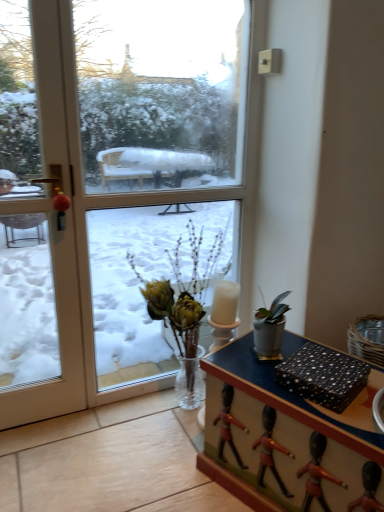
Find the location of a particular element. The width and height of the screenshot is (384, 512). black dotted paper at lower right is located at coordinates (323, 376).

Considering the relative sizes of translucent glass vase at center and wooden desk at center in the image provided, is translucent glass vase at center smaller than wooden desk at center?

Incorrect, translucent glass vase at center is not smaller in size than wooden desk at center.

How many degrees apart are the facing directions of translucent glass vase at center and wooden desk at center?

The facing directions of translucent glass vase at center and wooden desk at center are 65.6 degrees apart.

This screenshot has height=512, width=384. In order to click on desk below the translucent glass vase at center (from a real-world perspective) in this screenshot , I will do `click(283, 441)`.

Can we say translucent glass vase at center lies outside white glossy door at left?

translucent glass vase at center lies outside white glossy door at left's area.

Based on the photo, which object is closer to the camera, translucent glass vase at center or white glossy door at left?

white glossy door at left is closer to the camera.

Which object is positioned more to the right, translucent glass vase at center or white glossy door at left?

translucent glass vase at center.

From a real-world perspective, is translucent glass vase at center physically below white glossy door at left?

Yes.

Considering the positions of point (224, 377) and point (275, 374), is point (224, 377) closer or farther from the camera than point (275, 374)?

Point (224, 377) is farther from the camera than point (275, 374).

Can you confirm if wooden desk at center is positioned to the right of black dotted paper at lower right?

In fact, wooden desk at center is to the left of black dotted paper at lower right.

Is wooden desk at center aimed at white glossy door at left?

No, wooden desk at center is not oriented towards white glossy door at left.

Can you see wooden desk at center touching white glossy door at left?

They are not placed beside each other.

Is white glossy door at left a part of wooden desk at center?

No.

In the scene shown: Is wooden desk at center bigger or smaller than white glossy door at left?

wooden desk at center is bigger than white glossy door at left.

Is translucent glass vase at center located within black dotted paper at lower right?

That's incorrect, translucent glass vase at center is not inside black dotted paper at lower right.

Find the location of a particular element. This screenshot has width=384, height=512. houseplant above the black dotted paper at lower right (from the image's perspective) is located at coordinates (183, 309).

Is black dotted paper at lower right with translucent glass vase at center?

No, black dotted paper at lower right is not beside translucent glass vase at center.

From the image's perspective, is transparent glass window at center below wooden desk at center?

Actually, transparent glass window at center appears above wooden desk at center in the image.

Considering the sizes of objects transparent glass window at center and wooden desk at center in the image provided, who is thinner, transparent glass window at center or wooden desk at center?

With smaller width is transparent glass window at center.

From a real-world perspective, which is physically above, transparent glass window at center or wooden desk at center?

transparent glass window at center, from a real-world perspective.

Is transparent glass window at center not within wooden desk at center?

transparent glass window at center is positioned outside wooden desk at center.

Which object is thinner, wooden desk at center or translucent glass vase at center?

Thinner between the two is translucent glass vase at center.

Does wooden desk at center lie in front of translucent glass vase at center?

Yes, it is.

Where is `desk below the translucent glass vase at center (from the image's perspective)`? The image size is (384, 512). desk below the translucent glass vase at center (from the image's perspective) is located at coordinates (283, 441).

From the image's perspective, which one is positioned higher, wooden desk at center or translucent glass vase at center?

translucent glass vase at center, from the image's perspective.

Locate an element on the screen. This screenshot has height=512, width=384. desk that is on the right side of translucent glass vase at center is located at coordinates (283, 441).

I want to click on door above the translucent glass vase at center (from the image's perspective), so click(39, 311).

Considering their positions, is translucent glass vase at center positioned further to wooden desk at center than transparent glass window at center?

Among the two, transparent glass window at center is located further to wooden desk at center.

Which object lies further to the anchor point wooden desk at center, black dotted paper at lower right or translucent glass vase at center?

translucent glass vase at center.

When comparing their distances from translucent glass vase at center, does white glossy door at left or wooden desk at center seem closer?

wooden desk at center is closer to translucent glass vase at center.

From the image, which object appears to be nearer to translucent glass vase at center, black dotted paper at lower right or white glossy door at left?

black dotted paper at lower right.

From the image, which object appears to be farther from transparent glass window at center, translucent glass vase at center or white glossy door at left?

The object further to transparent glass window at center is translucent glass vase at center.

Looking at the image, which one is located closer to translucent glass vase at center, white glossy door at left or transparent glass window at center?

Among the two, transparent glass window at center is located nearer to translucent glass vase at center.

Considering their positions, is white glossy door at left positioned further to transparent glass window at center than translucent glass vase at center?

Among the two, translucent glass vase at center is located further to transparent glass window at center.

When comparing their distances from black dotted paper at lower right, does white glossy door at left or translucent glass vase at center seem further?

The object further to black dotted paper at lower right is white glossy door at left.

The width and height of the screenshot is (384, 512). I want to click on window situated between white glossy door at left and wooden desk at center from left to right, so click(x=120, y=188).

At what (x,y) coordinates should I click in order to perform the action: click on desk between white glossy door at left and black dotted paper at lower right from left to right. Please return your answer as a coordinate pair (x, y). Image resolution: width=384 pixels, height=512 pixels. Looking at the image, I should click on (283, 441).

Where is `houseplant between transparent glass window at center and wooden desk at center from top to bottom`? houseplant between transparent glass window at center and wooden desk at center from top to bottom is located at coordinates (183, 309).

Where is `houseplant between transparent glass window at center and black dotted paper at lower right from top to bottom`? The width and height of the screenshot is (384, 512). houseplant between transparent glass window at center and black dotted paper at lower right from top to bottom is located at coordinates (183, 309).